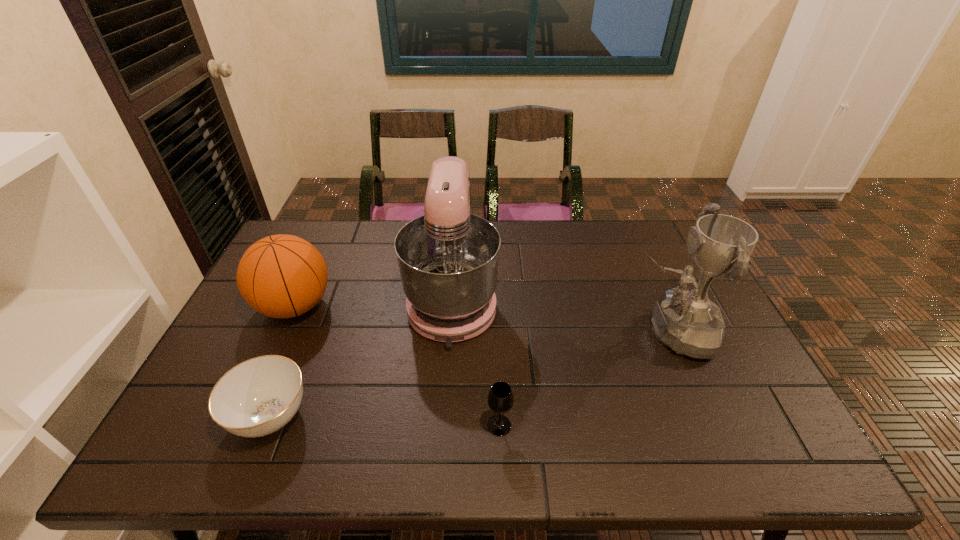
Find the location of `mixer`. mixer is located at coordinates (448, 258).

Where is `award`? award is located at coordinates (687, 321).

Find the location of a particular element. Image resolution: width=960 pixels, height=540 pixels. the third shortest object is located at coordinates (281, 276).

Locate an element on the screen. Image resolution: width=960 pixels, height=540 pixels. wineglass is located at coordinates (500, 399).

This screenshot has width=960, height=540. I want to click on the shortest object, so click(259, 396).

Find the location of a particular element. free point located 0.160m on the front-facing side of the mixer is located at coordinates (445, 405).

Locate an element on the screen. The width and height of the screenshot is (960, 540). vacant space situated on the side with emblem of the rightmost object is located at coordinates (596, 332).

Image resolution: width=960 pixels, height=540 pixels. Find the location of `vacant space positioned on the side with emblem of the rightmost object`. vacant space positioned on the side with emblem of the rightmost object is located at coordinates (521, 332).

At what (x,y) coordinates should I click in order to perform the action: click on free space located on the side with emblem of the rightmost object. Please return your answer as a coordinate pair (x, y). Looking at the image, I should click on (589, 332).

Image resolution: width=960 pixels, height=540 pixels. I want to click on vacant region located on the back of the third shortest object, so click(x=319, y=253).